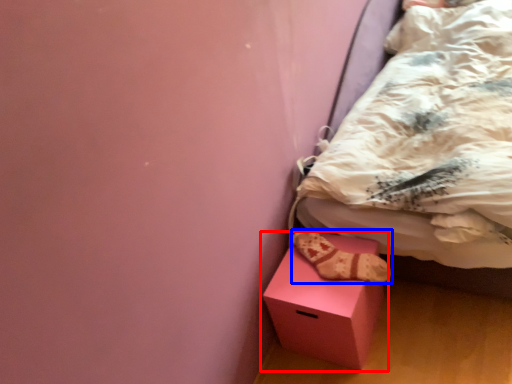
Question: Among these objects, which one is farthest to the camera, box (highlighted by a red box) or footwear (highlighted by a blue box)?

Choices:
 (A) box
 (B) footwear

Answer: (B)